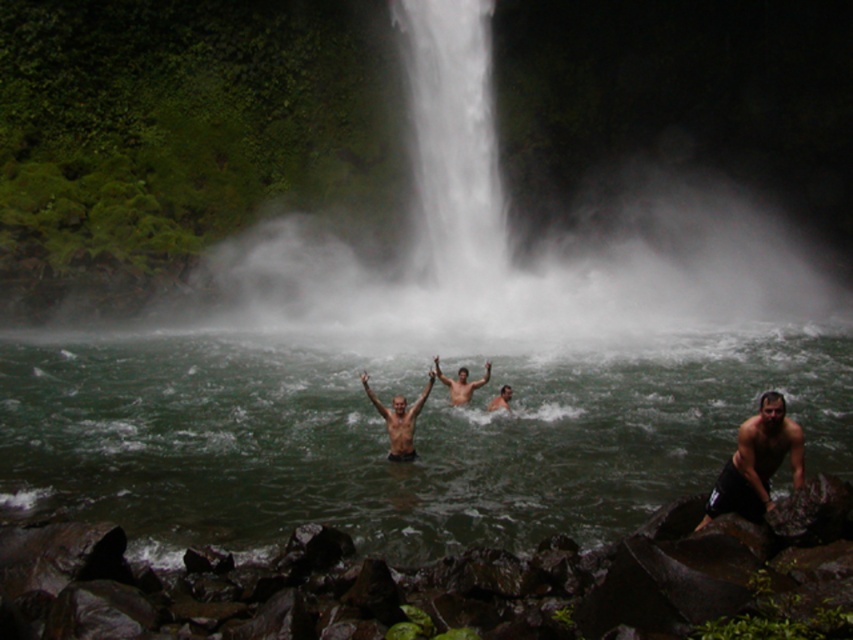
Can you confirm if green water at center is positioned to the left of white misty waterfall at center?

Correct, you'll find green water at center to the left of white misty waterfall at center.

Can you confirm if green water at center is smaller than white misty waterfall at center?

No, green water at center is not smaller than white misty waterfall at center.

Find the location of a particular element. The width and height of the screenshot is (853, 640). green water at center is located at coordinates (386, 435).

Find the location of a particular element. The height and width of the screenshot is (640, 853). green water at center is located at coordinates (386, 435).

Who is more forward, (x=531, y=493) or (x=728, y=470)?

Positioned in front is point (x=728, y=470).

Can you confirm if green water at center is positioned to the right of black matte shorts at lower right?

No, green water at center is not to the right of black matte shorts at lower right.

Locate an element on the screen. This screenshot has width=853, height=640. green water at center is located at coordinates (386, 435).

Does point (366, 499) come in front of point (410, 428)?

Yes.

Is point (691, 356) more distant than point (409, 449)?

Yes.

Find the location of `green water at center`. green water at center is located at coordinates (386, 435).